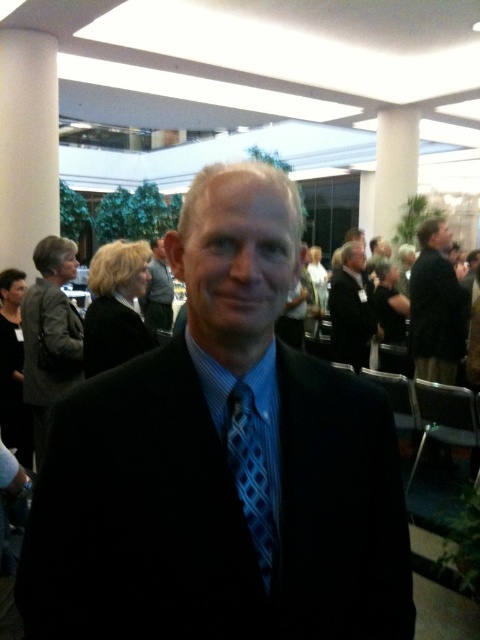
Is black silk suit at center to the left of black suit at right from the viewer's perspective?

Yes, black silk suit at center is to the left of black suit at right.

Is point (302, 512) positioned in front of point (466, 332)?

Yes.

Identify the location of black silk suit at center. The height and width of the screenshot is (640, 480). (222, 461).

Is black silk suit at center thinner than matte black suit at center?

In fact, black silk suit at center might be wider than matte black suit at center.

At what (x,y) coordinates should I click in order to perform the action: click on black silk suit at center. Please return your answer as a coordinate pair (x, y). Looking at the image, I should click on (222, 461).

Who is more distant from viewer, (118, 516) or (168, 307)?

Positioned behind is point (168, 307).

Where is `black silk suit at center`? The height and width of the screenshot is (640, 480). black silk suit at center is located at coordinates (222, 461).

Does blue woven tie at center come behind matte black suit at center?

No, blue woven tie at center is in front of matte black suit at center.

Can you confirm if blue woven tie at center is positioned to the left of matte black suit at center?

Incorrect, blue woven tie at center is not on the left side of matte black suit at center.

Which is behind, point (248, 419) or point (154, 317)?

The point (154, 317) is more distant.

At what (x,y) coordinates should I click in order to perform the action: click on blue woven tie at center. Please return your answer as a coordinate pair (x, y). This screenshot has height=640, width=480. Looking at the image, I should click on (252, 474).